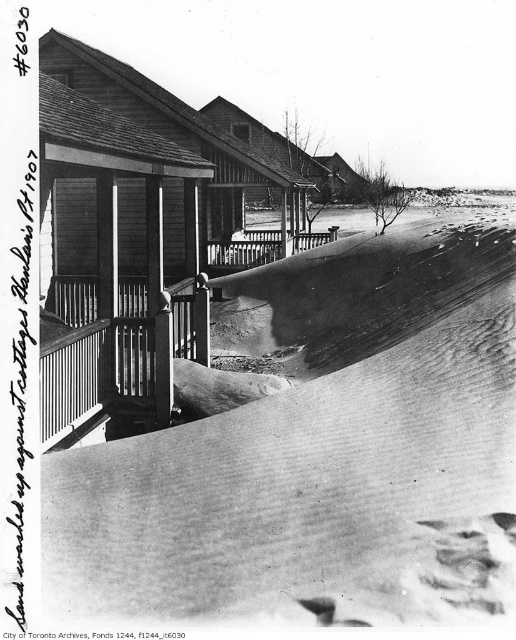
Question: Does wooden porch at center have a smaller size compared to wooden cabin at center?

Choices:
 (A) yes
 (B) no

Answer: (B)

Question: Among these objects, which one is nearest to the camera?

Choices:
 (A) wooden railing at center
 (B) white powdery snow at center
 (C) wooden cabin at center
 (D) wooden porch at center

Answer: (B)

Question: Considering the real-world distances, which object is farthest from the wooden cabin at center?

Choices:
 (A) wooden railing at center
 (B) wooden porch at center
 (C) white powdery snow at center

Answer: (A)

Question: Observing the image, what is the correct spatial positioning of white powdery snow at center in reference to wooden porch at center?

Choices:
 (A) below
 (B) above

Answer: (A)

Question: Is wooden porch at center bigger than wooden cabin at center?

Choices:
 (A) no
 (B) yes

Answer: (B)

Question: Among these objects, which one is nearest to the camera?

Choices:
 (A) white powdery snow at center
 (B) wooden cabin at center

Answer: (A)